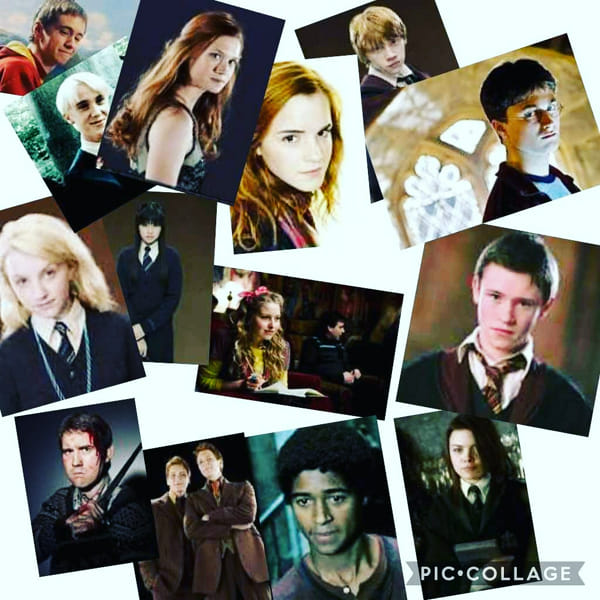
Where is `window`? This screenshot has height=600, width=600. window is located at coordinates (444, 204), (467, 133).